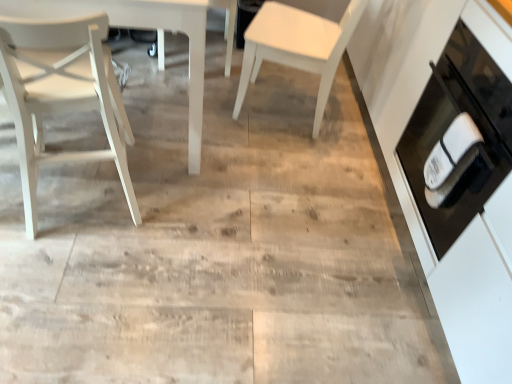
Question: Is black glass oven at right positioned before white matte chair at left, which ranks as the first chair in left-to-right order?

Choices:
 (A) yes
 (B) no

Answer: (B)

Question: Does black glass oven at right have a lesser height compared to white matte chair at left, which ranks as the first chair in left-to-right order?

Choices:
 (A) yes
 (B) no

Answer: (A)

Question: Can you confirm if black glass oven at right is taller than white matte chair at left, which ranks as the 3th chair in right-to-left order?

Choices:
 (A) yes
 (B) no

Answer: (B)

Question: Are black glass oven at right and white matte chair at left, which ranks as the first chair in left-to-right order, beside each other?

Choices:
 (A) yes
 (B) no

Answer: (B)

Question: Is black glass oven at right looking in the opposite direction of white matte chair at left, which ranks as the 3th chair in right-to-left order?

Choices:
 (A) no
 (B) yes

Answer: (A)

Question: Is white matte chair at center, the third chair when ordered from left to right, taller or shorter than white matte chair at center, arranged as the second chair when viewed from the right?

Choices:
 (A) tall
 (B) short

Answer: (A)

Question: Would you say white matte chair at center, the 1th chair in the right-to-left sequence, is inside or outside white matte chair at center, arranged as the second chair when viewed from the right?

Choices:
 (A) inside
 (B) outside

Answer: (B)

Question: Is white matte chair at center, the third chair when ordered from left to right, to the left or to the right of white matte chair at center, arranged as the second chair when viewed from the right, in the image?

Choices:
 (A) right
 (B) left

Answer: (A)

Question: Considering the positions of white matte chair at center, the 1th chair in the right-to-left sequence, and white matte chair at center, the second chair in the left-to-right sequence, in the image, is white matte chair at center, the 1th chair in the right-to-left sequence, bigger or smaller than white matte chair at center, the second chair in the left-to-right sequence,?

Choices:
 (A) big
 (B) small

Answer: (A)

Question: Considering the positions of white matte chair at left, which ranks as the 3th chair in right-to-left order, and white matte chair at center, the third chair when ordered from left to right, in the image, is white matte chair at left, which ranks as the 3th chair in right-to-left order, taller or shorter than white matte chair at center, the third chair when ordered from left to right,?

Choices:
 (A) short
 (B) tall

Answer: (B)

Question: Considering their positions, is white matte chair at left, which ranks as the 3th chair in right-to-left order, located in front of or behind white matte chair at center, the 1th chair in the right-to-left sequence?

Choices:
 (A) behind
 (B) front

Answer: (B)

Question: From the image's perspective, is white matte chair at left, which ranks as the 3th chair in right-to-left order, above or below white matte chair at center, the 1th chair in the right-to-left sequence?

Choices:
 (A) above
 (B) below

Answer: (B)

Question: Does point (116, 109) appear closer or farther from the camera than point (348, 23)?

Choices:
 (A) closer
 (B) farther

Answer: (A)

Question: Would you say white matte chair at center, the 1th chair in the right-to-left sequence, is to the left or to the right of white matte chair at left, which ranks as the 3th chair in right-to-left order, in the picture?

Choices:
 (A) right
 (B) left

Answer: (A)

Question: From a real-world perspective, is white matte chair at center, the 1th chair in the right-to-left sequence, physically located above or below white matte chair at left, which ranks as the first chair in left-to-right order?

Choices:
 (A) below
 (B) above

Answer: (A)